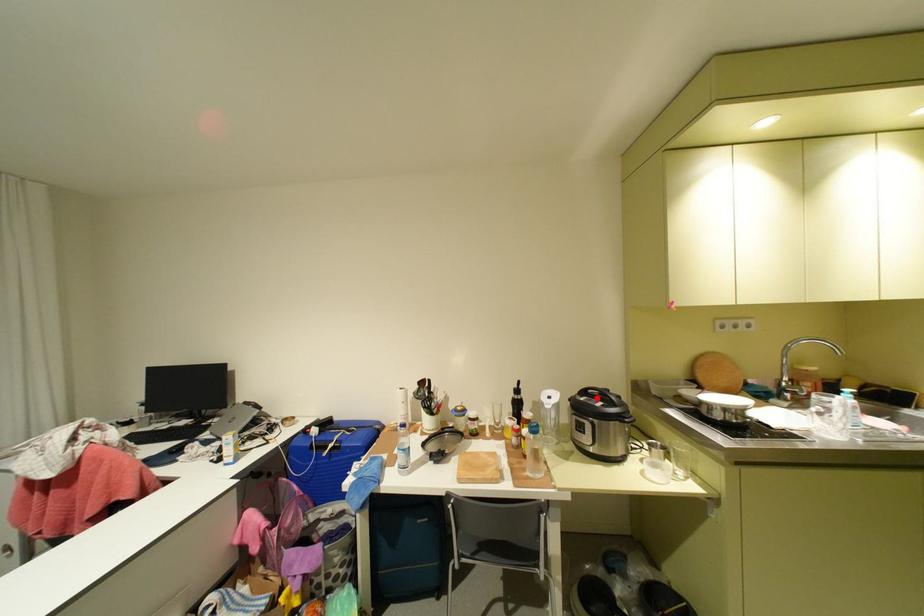
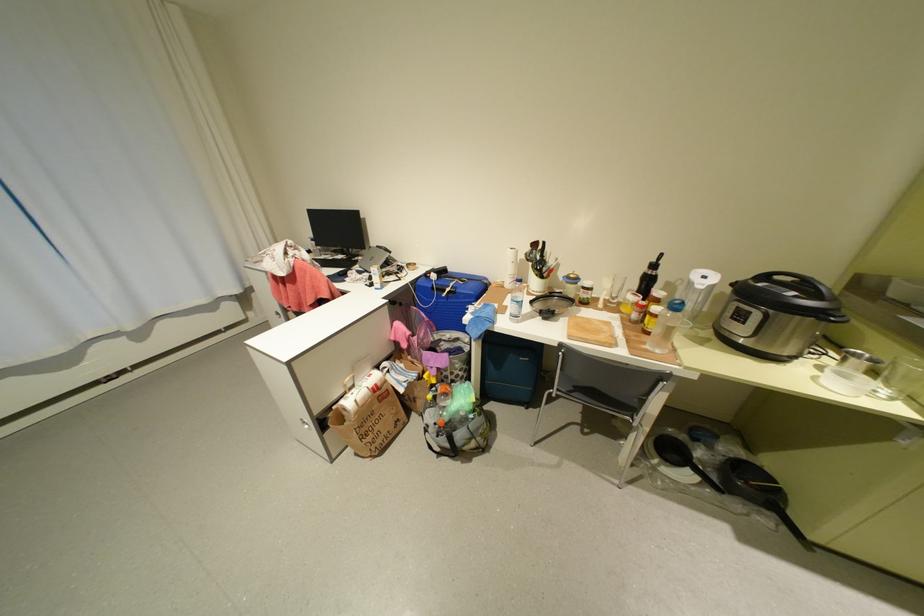
Where in the second image is the point corresponding to the highlighted location from the first image?

(777, 284)